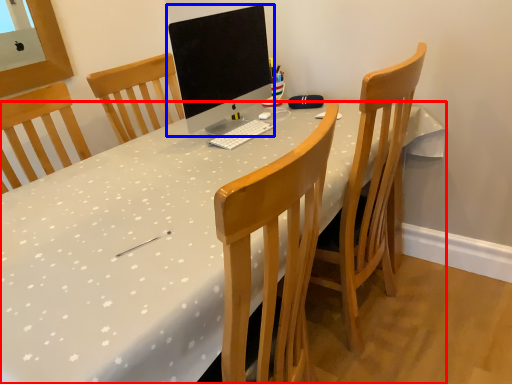
Question: Which object is further to the camera taking this photo, desk (highlighted by a red box) or computer monitor (highlighted by a blue box)?

Choices:
 (A) desk
 (B) computer monitor

Answer: (B)